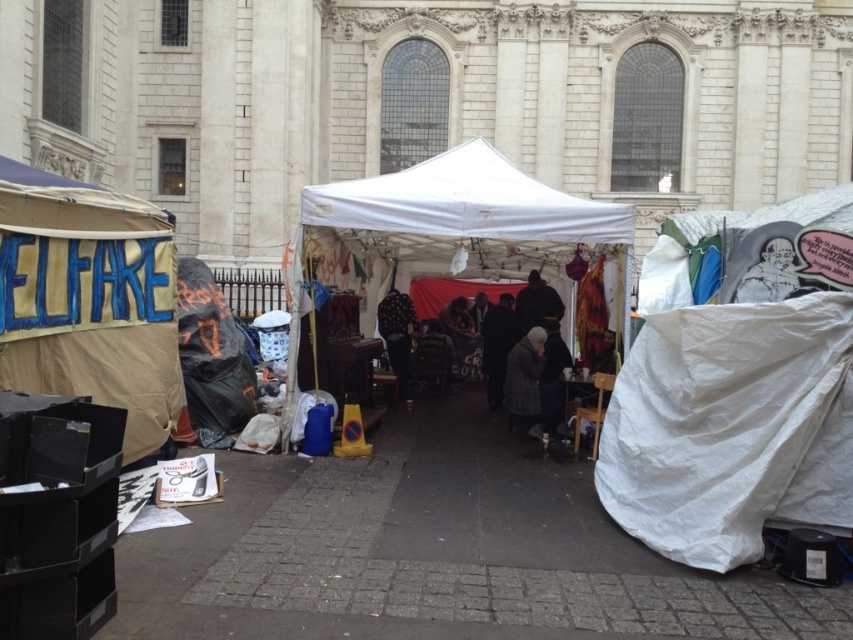
You are planning to set up a temporary shelter in the area shown. The white tarp at right and the white fabric canopy at center are already present. Which one would provide more vertical space for standing inside?

The white fabric canopy at center is taller than the white tarp at right, so it provides more vertical space for standing inside.

You are a visitor approaching the large ornate building and see the beige canvas tent at left and the white fabric canopy at center. Which structure is closer to the building?

The beige canvas tent at left is closer to the building because it is positioned to the left of the white fabric canopy at center, which is further away from the building.

You are a visitor at this event and want to take a photo of the white fabric tent at center and the fuzzy gray coat at center. Which object should you focus on first to ensure it appears larger in your photo?

The white fabric tent at center is taller than the fuzzy gray coat at center, so focusing on it first will make it appear larger in the photo.